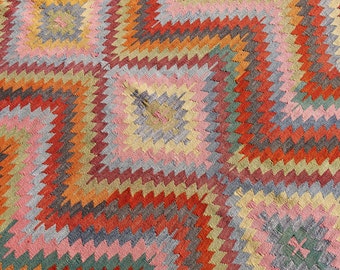
Identify the location of gray threads or yarn used to make rug or blanket. The height and width of the screenshot is (270, 340). (231, 199).